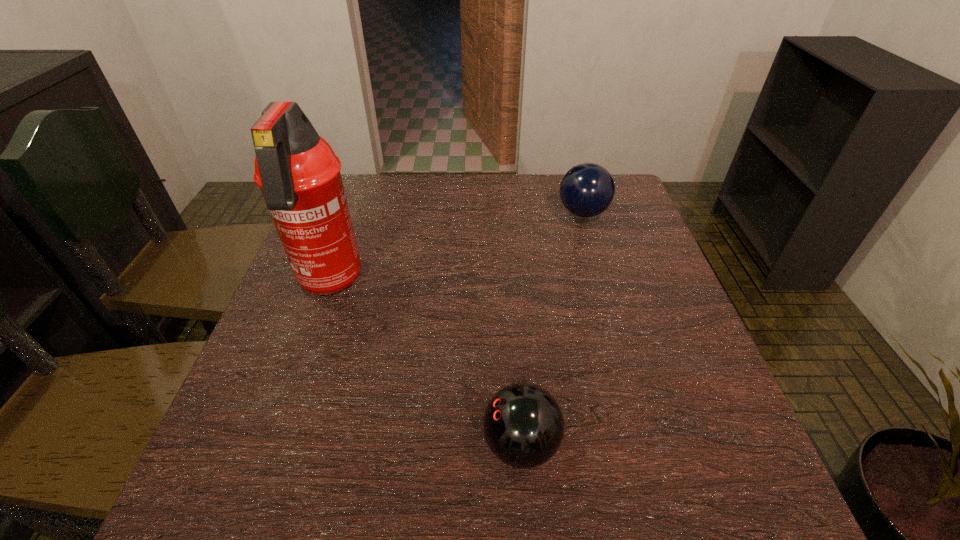
Find the location of a particular element. free region located on the surface of the second object from left to right near the finger holes is located at coordinates (251, 444).

You are a GUI agent. You are given a task and a screenshot of the screen. Output one action in this format:
    pyautogui.click(x=<x>, y=<y>)
    Task: Click on the vacant region located on the surface of the second object from left to right near the finger holes
    The height and width of the screenshot is (540, 960).
    Given the screenshot: What is the action you would take?
    pyautogui.click(x=304, y=444)

This screenshot has height=540, width=960. I want to click on vacant space situated 0.160m on the surface of the second object from left to right near the finger holes, so click(388, 444).

Identify the location of object at the far edge. (586, 190).

Locate an element on the screen. The width and height of the screenshot is (960, 540). object at the near edge is located at coordinates (523, 425).

Where is `object that is at the left edge`? This screenshot has width=960, height=540. object that is at the left edge is located at coordinates (299, 175).

The width and height of the screenshot is (960, 540). In order to click on object that is at the right edge in this screenshot , I will do `click(586, 190)`.

This screenshot has width=960, height=540. I want to click on object that is at the far right corner, so click(586, 190).

This screenshot has width=960, height=540. In order to click on free space at the far edge of the desktop in this screenshot , I will do `click(502, 200)`.

This screenshot has height=540, width=960. Identify the location of free space at the near edge of the desktop. (398, 502).